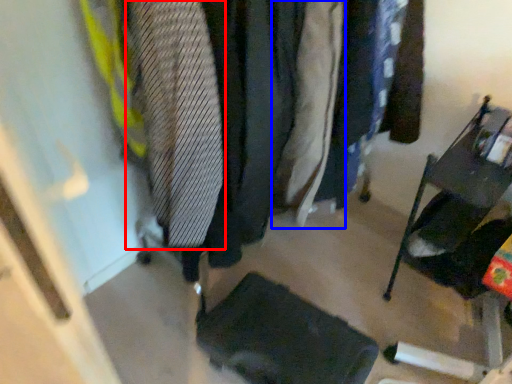
Question: Which object is closer to the camera taking this photo, tie (highlighted by a red box) or clothing (highlighted by a blue box)?

Choices:
 (A) tie
 (B) clothing

Answer: (A)